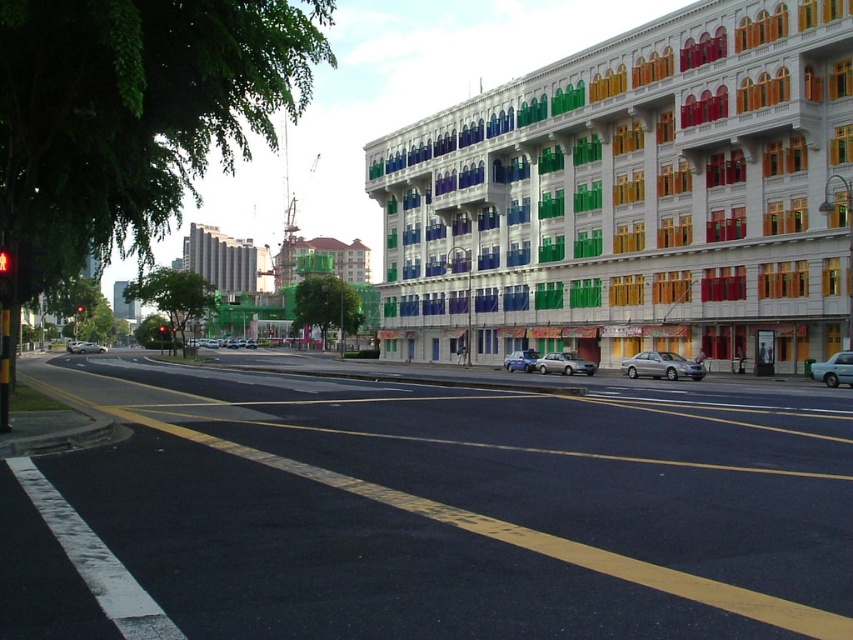
You are a delivery driver approaching the red glass traffic light at upper center and need to park your satin silver sedan at center. Can your sedan fit between the parked cars on the right side of the road?

The satin silver sedan at center has a lesser width compared to the red glass traffic light at upper center, but the width of the parked cars on the right side of the road is not provided. Therefore, it is impossible to determine if the sedan can fit between them based on the given information.